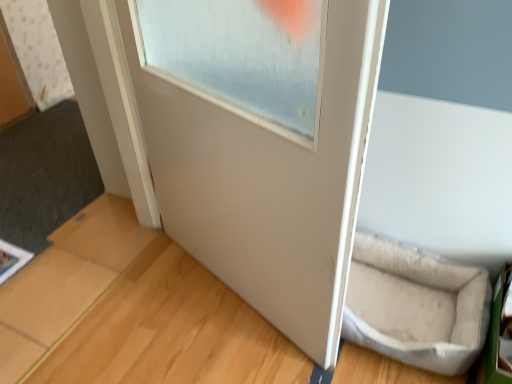
Find the location of `vacant space situated above light brown wood at lower right (from a real-world perspective)`. vacant space situated above light brown wood at lower right (from a real-world perspective) is located at coordinates (209, 327).